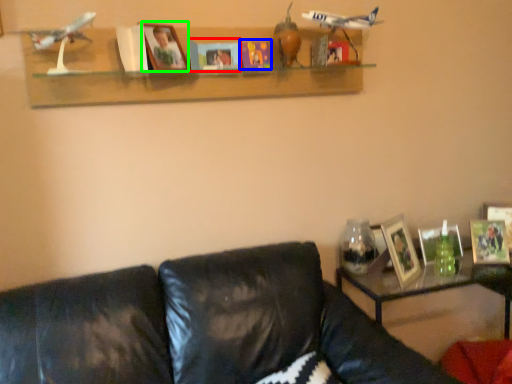
Question: Which object is positioned closest to paperback book (highlighted by a red box)? Select from paperback book (highlighted by a blue box) and picture frame (highlighted by a green box).

Choices:
 (A) paperback book
 (B) picture frame

Answer: (A)